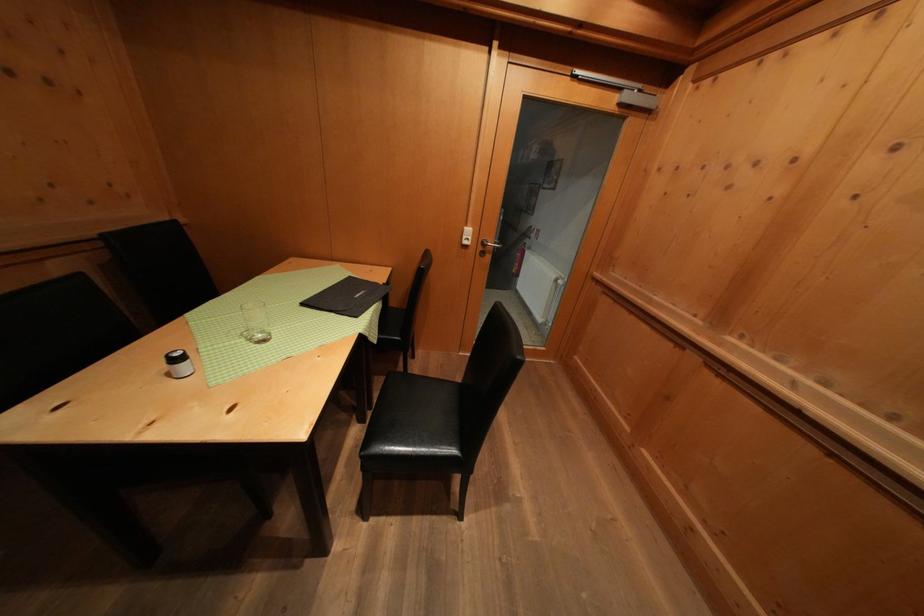
Where is `glass tumbler`? The image size is (924, 616). glass tumbler is located at coordinates (256, 322).